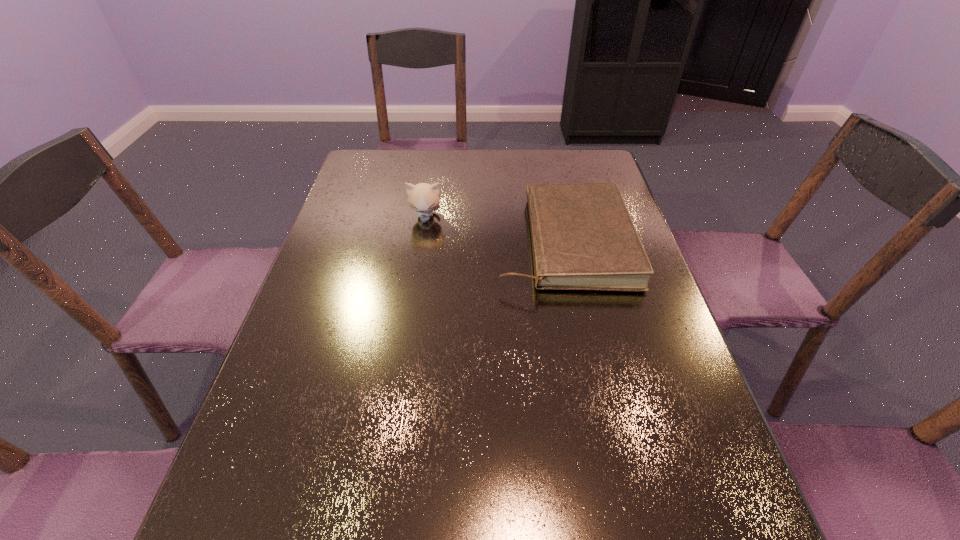
Locate an element on the screen. Image resolution: width=960 pixels, height=540 pixels. kitten is located at coordinates (423, 198).

What are the coordinates of `the left object` in the screenshot? It's located at (423, 198).

Find the location of a particular element. The height and width of the screenshot is (540, 960). paperback book is located at coordinates (583, 238).

Where is `the shorter object`? This screenshot has width=960, height=540. the shorter object is located at coordinates (583, 238).

You are a GUI agent. You are given a task and a screenshot of the screen. Output one action in this format:
    pyautogui.click(x=<x>, y=<y>)
    Task: Click on the vacant area located 0.160m on the face of the kitten
    
    Given the screenshot: What is the action you would take?
    pyautogui.click(x=419, y=262)

At what (x,y) coordinates should I click in order to perform the action: click on free space located on the spine side of the shorter object. Please return your answer as a coordinate pair (x, y). The height and width of the screenshot is (540, 960). Looking at the image, I should click on (460, 242).

You are a GUI agent. You are given a task and a screenshot of the screen. Output one action in this format:
    pyautogui.click(x=<x>, y=<y>)
    Task: Click on the vacant region located 0.260m on the spine side of the shorter object
    Image resolution: width=960 pixels, height=540 pixels.
    Given the screenshot: What is the action you would take?
    pyautogui.click(x=402, y=242)

In order to click on vacant space located 0.120m on the spine side of the shorter object in this screenshot , I will do `click(453, 242)`.

Find the location of a particular element. The image size is (960, 540). object that is at the right edge is located at coordinates (583, 238).

Identify the location of vacant space at the far edge of the desktop. This screenshot has height=540, width=960. (445, 172).